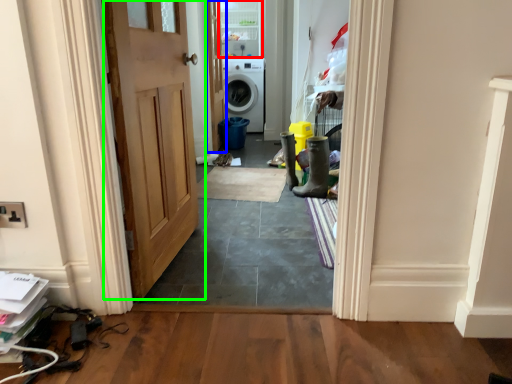
Question: Which object is positioned closest to glass door (highlighted by a red box)? Select from door (highlighted by a blue box) and door (highlighted by a green box).

Choices:
 (A) door
 (B) door

Answer: (A)